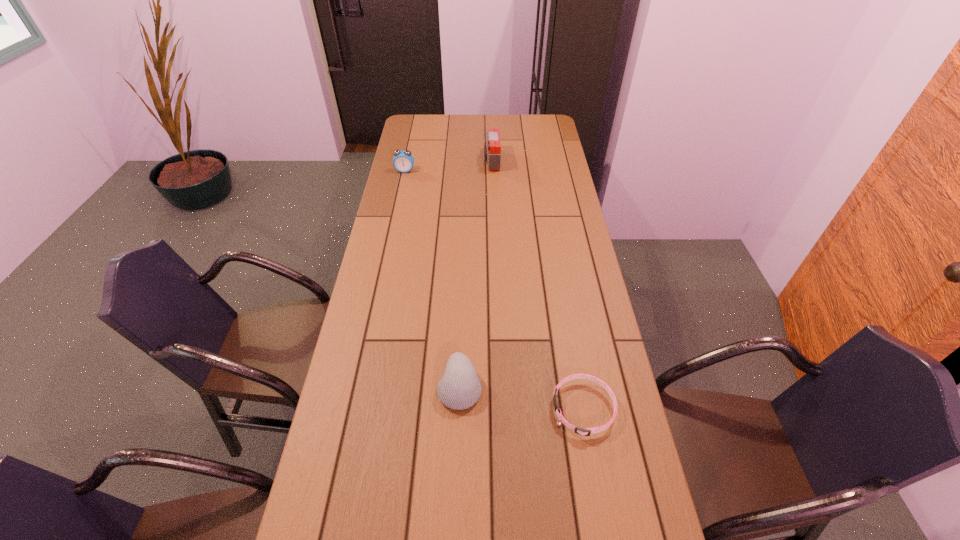
The width and height of the screenshot is (960, 540). What are the coordinates of `the tallest object` in the screenshot? It's located at (492, 148).

Locate an element on the screen. camera is located at coordinates (492, 148).

At what (x,y) coordinates should I click in order to perform the action: click on alarm clock. Please return your answer as a coordinate pair (x, y). Looking at the image, I should click on (403, 161).

You are a GUI agent. You are given a task and a screenshot of the screen. Output one action in this format:
    pyautogui.click(x=<x>, y=<y>)
    Task: Click on the third object from right to left
    The width and height of the screenshot is (960, 540).
    Given the screenshot: What is the action you would take?
    pyautogui.click(x=460, y=388)

You are a GUI agent. You are given a task and a screenshot of the screen. Output one action in this format:
    pyautogui.click(x=<x>, y=<y>)
    Task: Click on the shortest object
    This screenshot has width=960, height=540.
    Given the screenshot: What is the action you would take?
    pyautogui.click(x=586, y=431)

Where is `dog collar`? The width and height of the screenshot is (960, 540). dog collar is located at coordinates (586, 431).

Identify the location of free space located 0.330m on the front-facing side of the camera. (410, 161).

Find the location of a particular element. The height and width of the screenshot is (540, 960). vacant space located 0.270m on the front-facing side of the camera is located at coordinates (423, 161).

Where is `free region located 0.060m on the front-facing side of the camera`? free region located 0.060m on the front-facing side of the camera is located at coordinates [x=470, y=161].

Where is `vacant space located 0.120m on the face of the leftmost object`? vacant space located 0.120m on the face of the leftmost object is located at coordinates (400, 190).